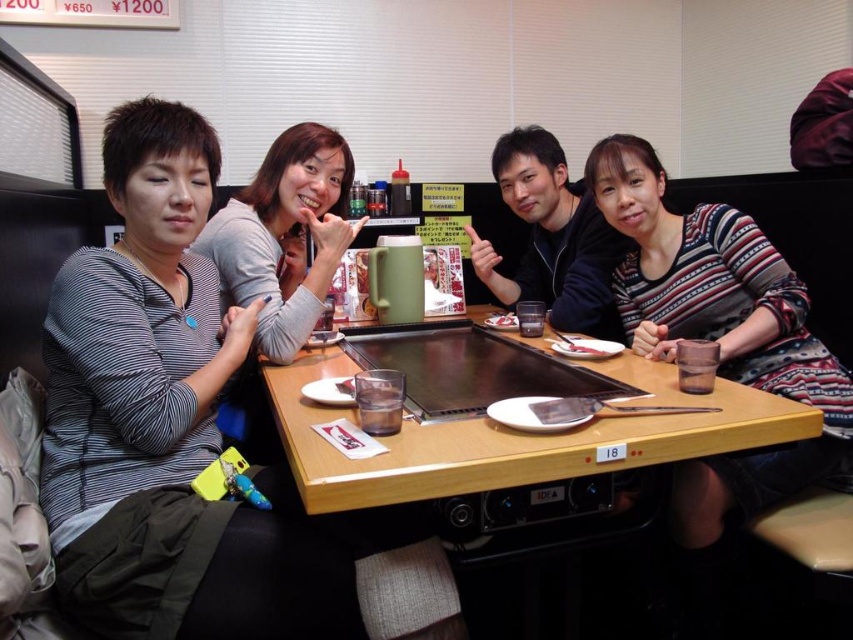
From the picture: Which of these two, striped sweater at upper right or white glossy rice at center, stands taller?

Standing taller between the two is striped sweater at upper right.

Who is more forward, (759, 376) or (508, 328)?

Point (759, 376)

This screenshot has height=640, width=853. What are the coordinates of `striped sweater at upper right` in the screenshot? It's located at (717, 328).

Who is positioned more to the right, matte gray sweater at upper left or white glossy rice at center?

Positioned to the right is white glossy rice at center.

Who is higher up, matte gray sweater at upper left or white glossy rice at center?

Positioned higher is matte gray sweater at upper left.

Which is in front, point (305, 266) or point (489, 320)?

Point (489, 320) is more forward.

This screenshot has width=853, height=640. What are the coordinates of `matte gray sweater at upper left` in the screenshot? It's located at (283, 236).

Does striped sweater at upper right have a greater height compared to wooden table at center?

Indeed, striped sweater at upper right has a greater height compared to wooden table at center.

Is point (643, 253) positioned before point (403, 435)?

No, (643, 253) is further to viewer.

The image size is (853, 640). I want to click on striped sweater at upper right, so click(717, 328).